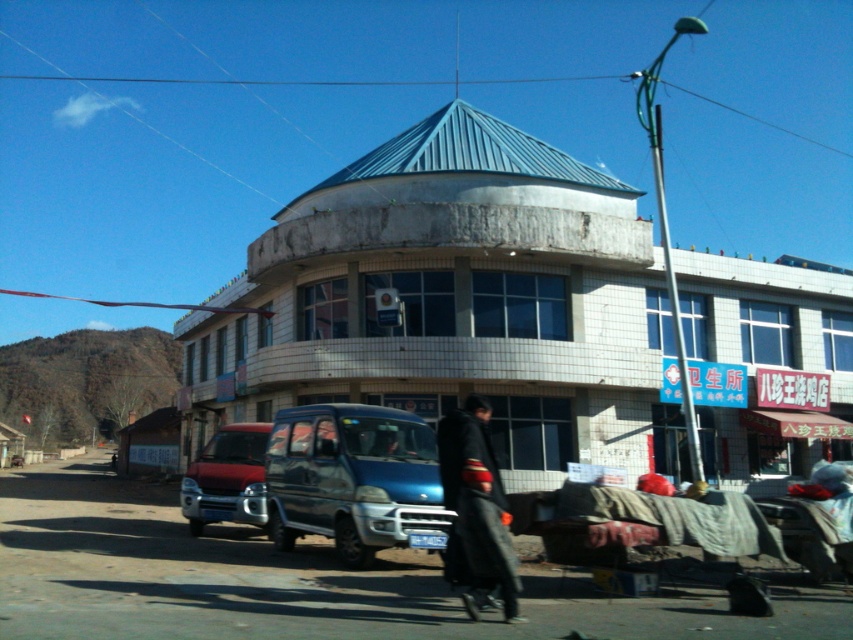
Based on the photo, you are a pedestrian standing on the sidewalk and want to cross the road to reach the teal roof building. The blue metallic van at center and the matte red van at center are parked on the road. Which van do you need to go around to safely reach the building?

The blue metallic van at center is located above the matte red van at center, so you should go around the blue metallic van at center to safely reach the teal roof building.